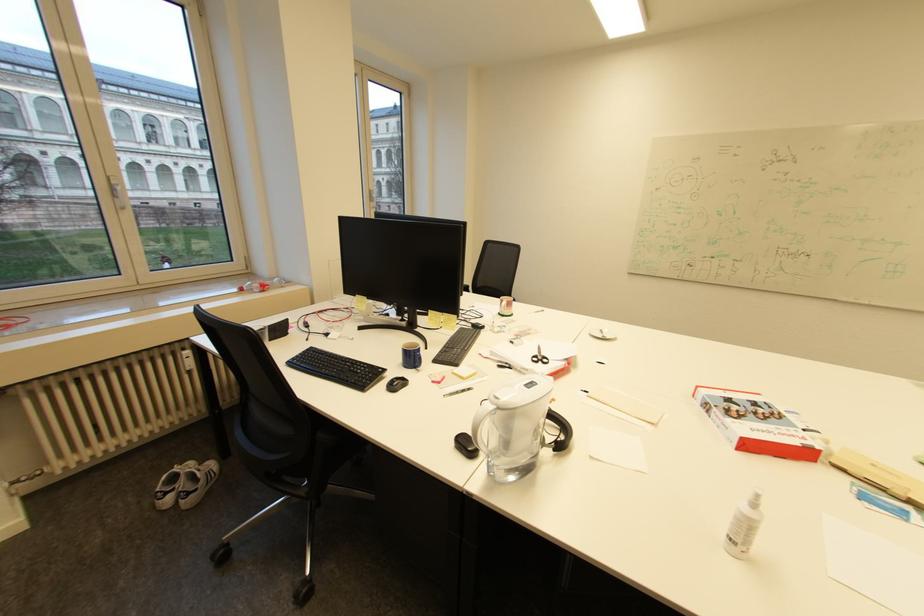
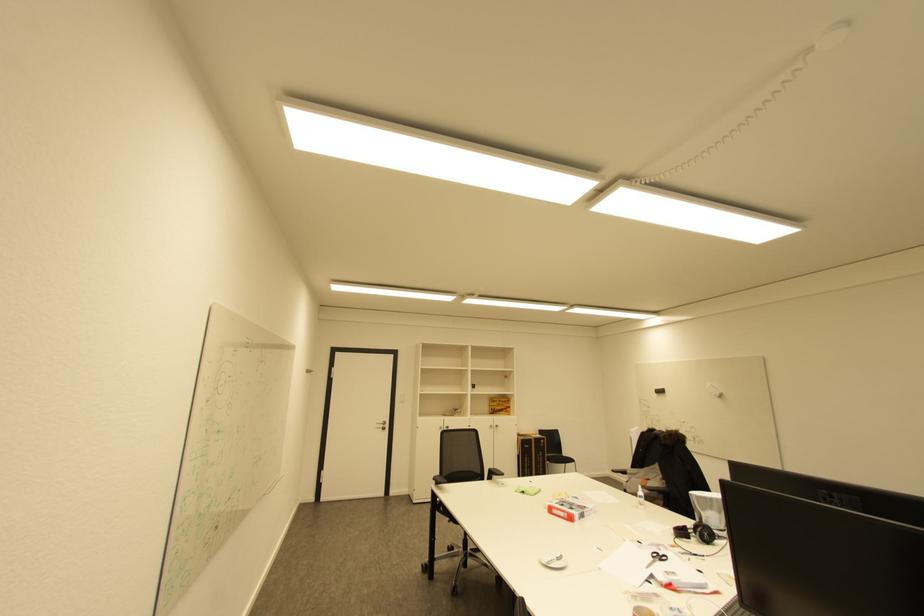
Locate, in the second image, the point that corresponds to the point at 761,405 in the first image.

(568, 506)